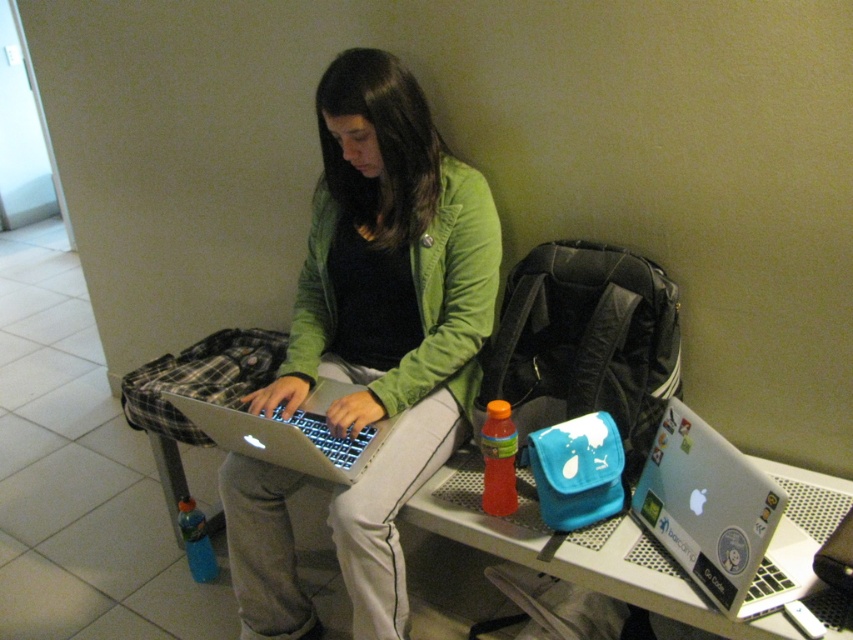
Is green matte jacket at center to the left of silver metallic laptop at center from the viewer's perspective?

No, green matte jacket at center is not to the left of silver metallic laptop at center.

Does green matte jacket at center have a smaller size compared to silver metallic laptop at center?

Incorrect, green matte jacket at center is not smaller in size than silver metallic laptop at center.

Measure the distance between point (410, 451) and camera.

A distance of 5.28 feet exists between point (410, 451) and camera.

Locate an element on the screen. green matte jacket at center is located at coordinates (387, 308).

The height and width of the screenshot is (640, 853). Describe the element at coordinates (721, 518) in the screenshot. I see `silver metallic laptop at lower right` at that location.

Looking at this image, which is more to the left, silver metallic laptop at lower right or silver metallic laptop at center?

silver metallic laptop at center is more to the left.

Where is `silver metallic laptop at lower right`? The width and height of the screenshot is (853, 640). silver metallic laptop at lower right is located at coordinates (721, 518).

Is point (608, 538) positioned behind point (230, 412)?

Yes, it is.

Is point (734, 636) closer to camera compared to point (281, 456)?

Yes, point (734, 636) is in front of point (281, 456).

The image size is (853, 640). In order to click on metallic silver table at lower center in this screenshot , I will do `click(576, 550)`.